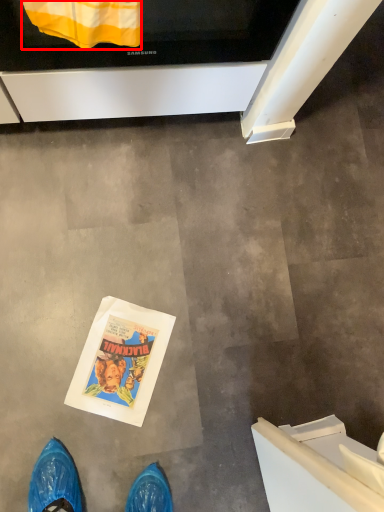
Question: From the image's perspective, where is blanket (annotated by the red box) located in relation to oven in the image?

Choices:
 (A) below
 (B) above

Answer: (A)